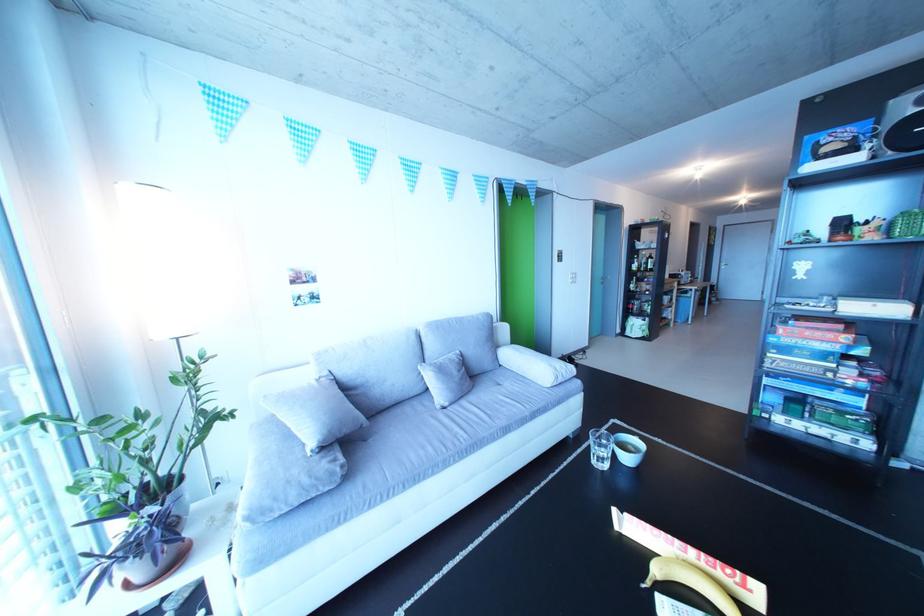
Locate an element on the screen. blue ceramic bowl is located at coordinates (628, 448).